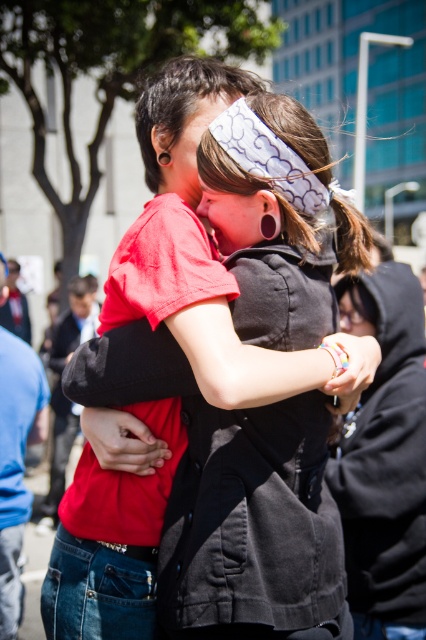
You are a photographer trying to capture the two people in the scene. You notice two points marked in the image. The first point is at coordinates point (x=253, y=227) and the second point is at point (x=362, y=310). Which point is closer to the camera?

Point (x=253, y=227) is in front of point (x=362, y=310), so it is closer to the camera.

You are a photographer adjusting the camera to capture the two people in the image. The camera has a focus range that can only accommodate objects within 12 inches of each other. Based on the scene, will the red matte shirt at center and the white printed fabric headband at center be within the focus range?

The red matte shirt at center and white printed fabric headband at center are 12.54 inches apart, which exceeds the camera focus range of 12 inches. Therefore, they will not be within the focus range.

You are a photographer adjusting the lighting for a portrait. You have two items in the scene that need to be lit properly. The red matte shirt at center and the white printed fabric headband at center. Based on their positions, which item is wider and requires more even lighting to avoid shadows?

The red matte shirt at center might be wider than white printed fabric headband at center, so it requires more even lighting to avoid shadows.